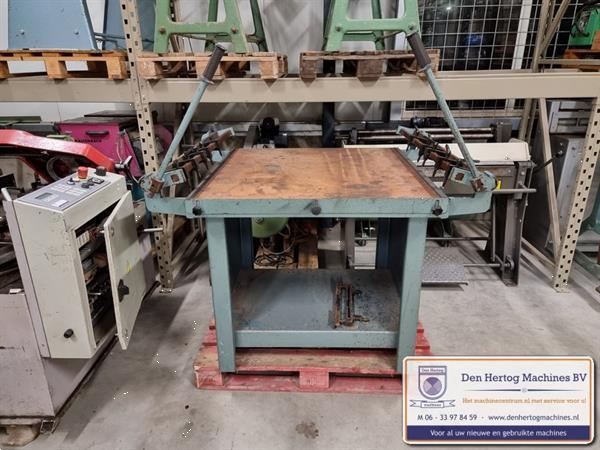
At what (x,y) coordinates should I click in order to perform the action: click on box. Please return your answer as a coordinate pair (x, y). The height and width of the screenshot is (450, 600). Looking at the image, I should click on (42, 290).